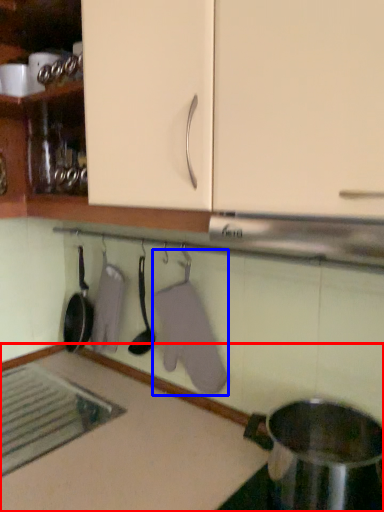
Question: Which of the following is the closest to the observer, countertop (highlighted by a red box) or laundry (highlighted by a blue box)?

Choices:
 (A) countertop
 (B) laundry

Answer: (A)